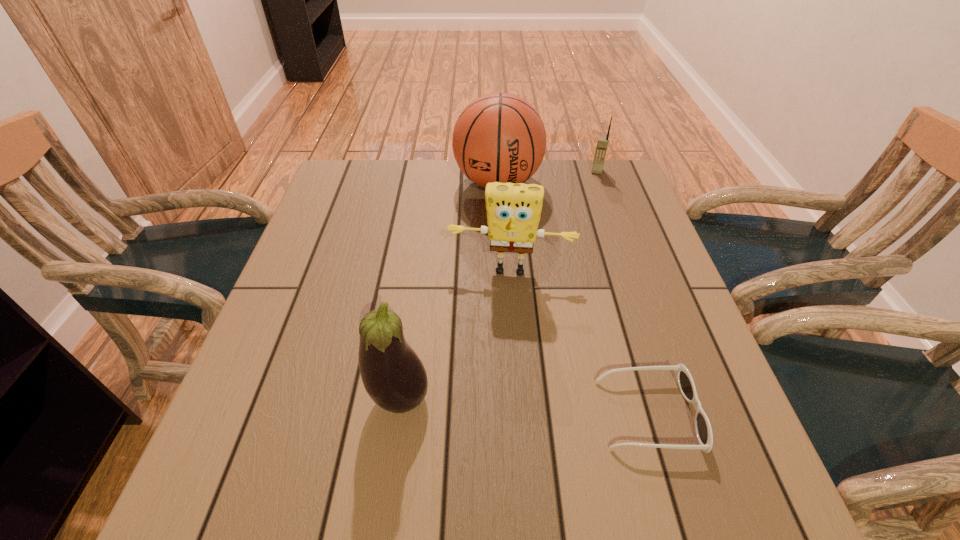
The height and width of the screenshot is (540, 960). I want to click on the leftmost object, so click(x=393, y=375).

The height and width of the screenshot is (540, 960). Identify the location of the shortest object. (685, 382).

Locate an element on the screen. The width and height of the screenshot is (960, 540). sponge is located at coordinates tap(513, 210).

The height and width of the screenshot is (540, 960). I want to click on cellular telephone, so click(602, 144).

Locate an element on the screen. basketball is located at coordinates (499, 137).

In order to click on free space located on the right of the leftmost object in this screenshot , I will do `click(583, 397)`.

Locate an element on the screen. free space located 0.060m with the lenses of the sunglasses facing outward is located at coordinates (728, 414).

Where is `vacant space located 0.060m on the face of the third farthest object`? vacant space located 0.060m on the face of the third farthest object is located at coordinates (504, 304).

Where is `vacant position located 0.060m on the face of the third farthest object`? The width and height of the screenshot is (960, 540). vacant position located 0.060m on the face of the third farthest object is located at coordinates (504, 304).

You are a GUI agent. You are given a task and a screenshot of the screen. Output one action in this format:
    pyautogui.click(x=<x>, y=<y>)
    Task: Click on the free space located on the face of the third farthest object
    
    Given the screenshot: What is the action you would take?
    pyautogui.click(x=503, y=311)